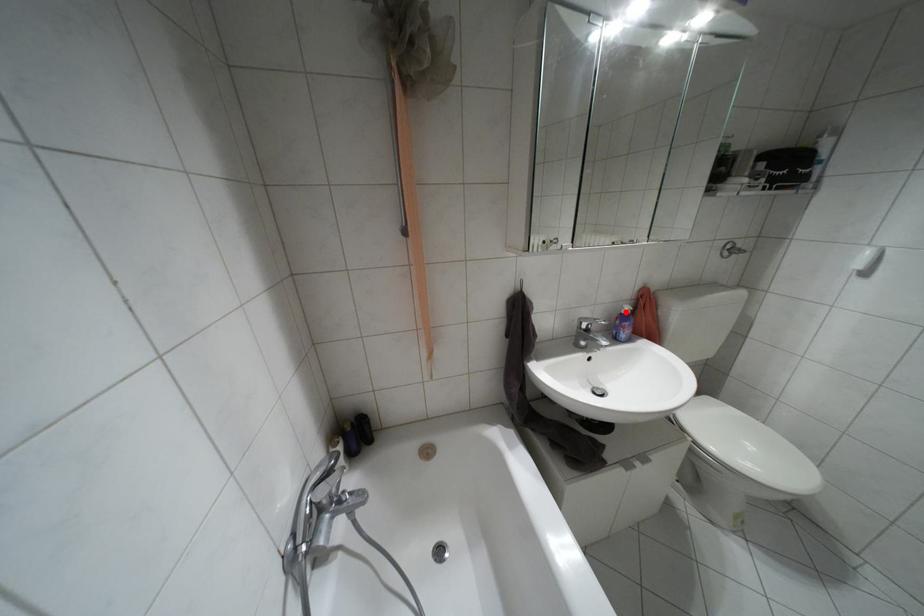
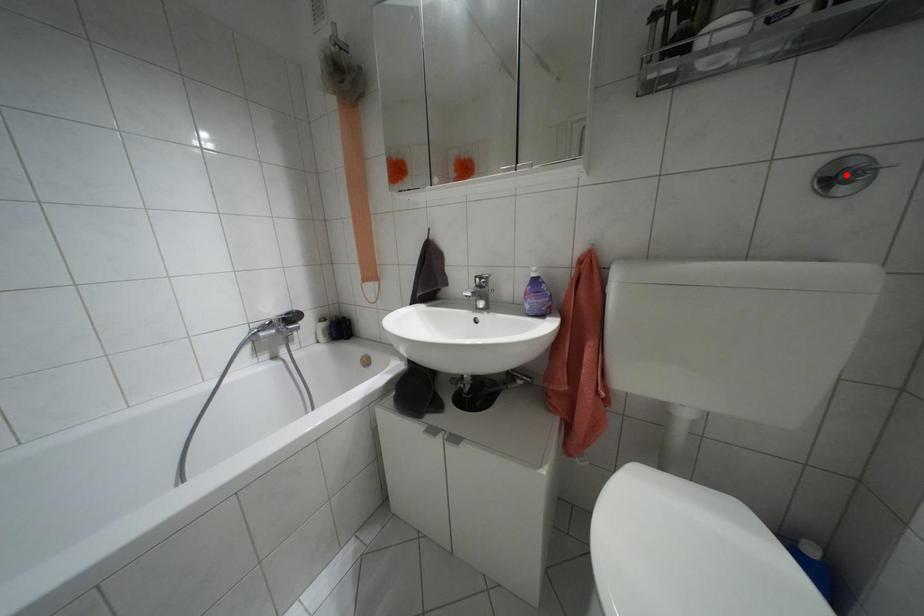
I am providing you with two images of the same scene from different viewpoints. A red point is marked on the first image and another point is marked on the second image. Are the points marked in image1 and image2 representing the same 3D position?

No